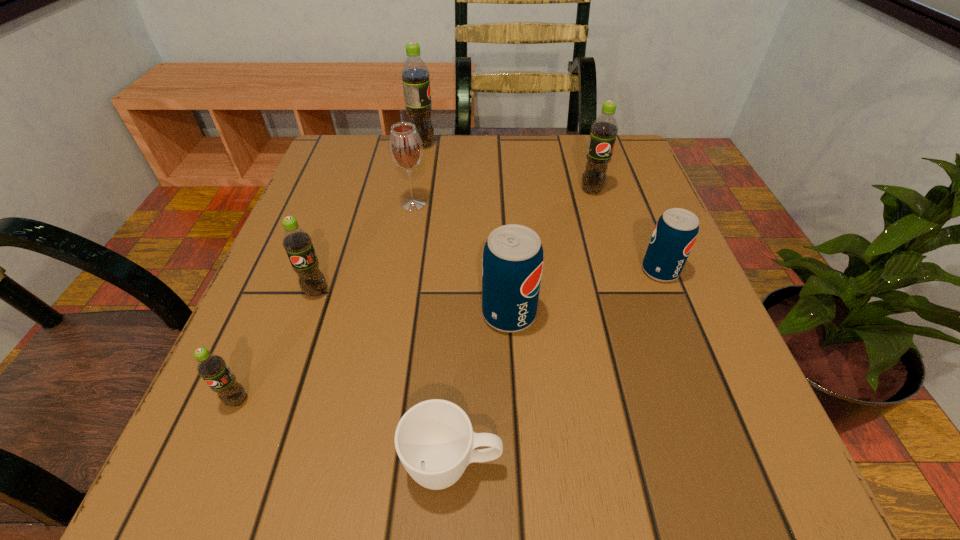
Where is `blank space located on the back of the rightmost object`? This screenshot has width=960, height=540. blank space located on the back of the rightmost object is located at coordinates point(628,191).

Find the location of `vacant space located 0.070m on the front label of the nearest green soda`. vacant space located 0.070m on the front label of the nearest green soda is located at coordinates (210, 464).

Locate an element on the screen. vacant space located with the handle on the side of the nearest object is located at coordinates (550, 466).

Locate an element on the screen. Image resolution: width=960 pixels, height=540 pixels. object that is at the near edge is located at coordinates point(435,442).

Locate an element on the screen. The height and width of the screenshot is (540, 960). object that is at the far right corner is located at coordinates (604, 129).

I want to click on free space at the far edge, so click(x=559, y=148).

Image resolution: width=960 pixels, height=540 pixels. What are the coordinates of `vacant space at the near edge of the desktop` in the screenshot? It's located at (487, 511).

In the image, there is a desktop. Where is `free space at the left edge`? The height and width of the screenshot is (540, 960). free space at the left edge is located at coordinates (302, 295).

Image resolution: width=960 pixels, height=540 pixels. What are the coordinates of `blank space at the right edge of the desktop` in the screenshot? It's located at (732, 425).

Image resolution: width=960 pixels, height=540 pixels. In the image, there is a desktop. Identify the location of free region at the far left corner. (311, 188).